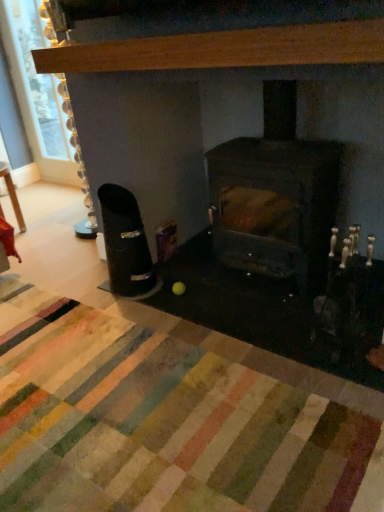
At what (x,y) coordinates should I click in order to perform the action: click on vacant area to the left of dark brown wood burning stove at center. Please return your answer as a coordinate pair (x, y). The width and height of the screenshot is (384, 512). Looking at the image, I should click on (185, 289).